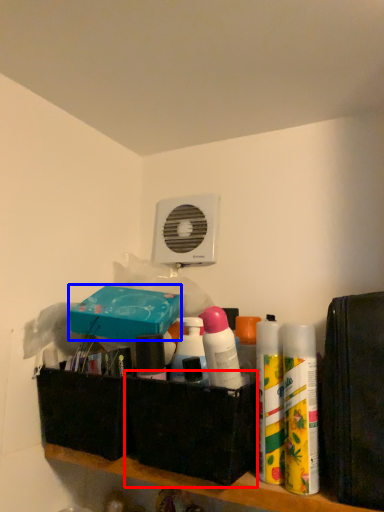
Question: Which point is closer to the camera, box (highlighted by a red box) or box (highlighted by a blue box)?

Choices:
 (A) box
 (B) box

Answer: (A)